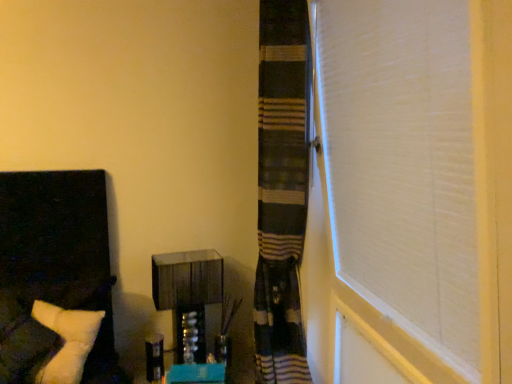
Question: Considering the relative sizes of metallic glass vanity at center and white soft pillow at left in the image provided, is metallic glass vanity at center taller than white soft pillow at left?

Choices:
 (A) yes
 (B) no

Answer: (B)

Question: Is metallic glass vanity at center positioned with its back to white soft pillow at left?

Choices:
 (A) yes
 (B) no

Answer: (B)

Question: From the image's perspective, is metallic glass vanity at center on white soft pillow at left?

Choices:
 (A) no
 (B) yes

Answer: (A)

Question: Could you tell me if metallic glass vanity at center is facing white soft pillow at left?

Choices:
 (A) yes
 (B) no

Answer: (B)

Question: From the image's perspective, is metallic glass vanity at center below white soft pillow at left?

Choices:
 (A) no
 (B) yes

Answer: (B)

Question: Considering the relative sizes of metallic glass vanity at center and white soft pillow at left in the image provided, is metallic glass vanity at center shorter than white soft pillow at left?

Choices:
 (A) no
 (B) yes

Answer: (B)

Question: Is white soft pillow at left to the right of metallic glass vanity at center from the viewer's perspective?

Choices:
 (A) no
 (B) yes

Answer: (A)

Question: From a real-world perspective, is white soft pillow at left positioned under metallic glass vanity at center based on gravity?

Choices:
 (A) no
 (B) yes

Answer: (A)

Question: Is white soft pillow at left not near metallic glass vanity at center?

Choices:
 (A) yes
 (B) no

Answer: (B)

Question: From the image's perspective, does white soft pillow at left appear higher than metallic glass vanity at center?

Choices:
 (A) no
 (B) yes

Answer: (B)

Question: Is white soft pillow at left facing towards metallic glass vanity at center?

Choices:
 (A) no
 (B) yes

Answer: (A)

Question: Is white soft pillow at left surrounding metallic glass vanity at center?

Choices:
 (A) yes
 (B) no

Answer: (B)

Question: Considering the positions of metallic glass vanity at center and white soft pillow at left in the image, is metallic glass vanity at center bigger or smaller than white soft pillow at left?

Choices:
 (A) small
 (B) big

Answer: (A)